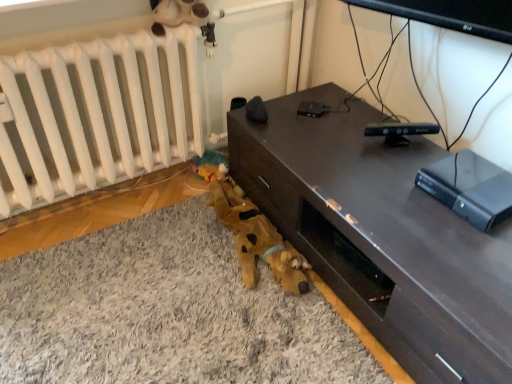
Question: Should I look upward or downward to see dark wood desk at center?

Choices:
 (A) up
 (B) down

Answer: (B)

Question: Is black plastic gaming console at right closer to the viewer compared to white matte radiator at lower left?

Choices:
 (A) yes
 (B) no

Answer: (A)

Question: Does black plastic gaming console at right have a smaller size compared to white matte radiator at lower left?

Choices:
 (A) no
 (B) yes

Answer: (B)

Question: Does black plastic gaming console at right have a greater width compared to white matte radiator at lower left?

Choices:
 (A) yes
 (B) no

Answer: (A)

Question: Can you confirm if black plastic gaming console at right is bigger than white matte radiator at lower left?

Choices:
 (A) no
 (B) yes

Answer: (A)

Question: From a real-world perspective, does black plastic gaming console at right sit lower than white matte radiator at lower left?

Choices:
 (A) no
 (B) yes

Answer: (B)

Question: Is black plastic gaming console at right completely or partially outside of white matte radiator at lower left?

Choices:
 (A) no
 (B) yes

Answer: (B)

Question: Is dark wood desk at center to the right of black plastic remote control at center, placed as the 1th gadget when sorted from back to front, from the viewer's perspective?

Choices:
 (A) yes
 (B) no

Answer: (A)

Question: Can you confirm if dark wood desk at center is taller than black plastic remote control at center, marked as the 1th gadget in a left-to-right arrangement?

Choices:
 (A) no
 (B) yes

Answer: (B)

Question: From a real-world perspective, is dark wood desk at center under black plastic remote control at center, marked as the 1th gadget in a left-to-right arrangement?

Choices:
 (A) no
 (B) yes

Answer: (B)

Question: Is the depth of dark wood desk at center less than that of black plastic remote control at center, marked as the 1th gadget in a left-to-right arrangement?

Choices:
 (A) yes
 (B) no

Answer: (A)

Question: Does dark wood desk at center have a greater width compared to black plastic remote control at center, the second gadget positioned from the front?

Choices:
 (A) yes
 (B) no

Answer: (A)

Question: Is dark wood desk at center placed right next to black plastic remote control at center, the 1th gadget positioned from the top?

Choices:
 (A) yes
 (B) no

Answer: (B)

Question: Is the depth of black plastic remote control at upper center, positioned as the 2th gadget in back-to-front order, less than that of white matte radiator at lower left?

Choices:
 (A) no
 (B) yes

Answer: (A)